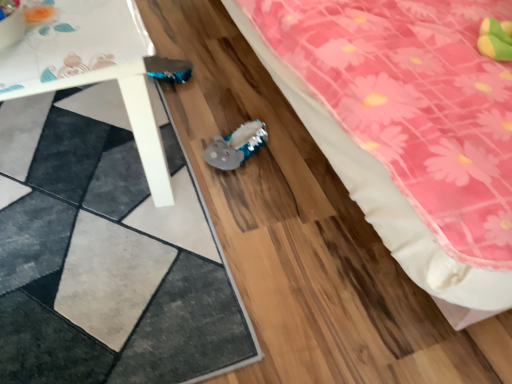
The image size is (512, 384). What are the coordinates of `vacant area that is in front of fuzzy fabric plushie at center` in the screenshot? It's located at (234, 198).